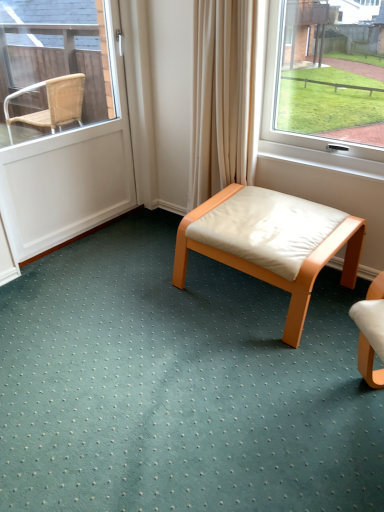
The width and height of the screenshot is (384, 512). Find the location of `free space that is to the left of light brown wood stool at center`. free space that is to the left of light brown wood stool at center is located at coordinates (144, 297).